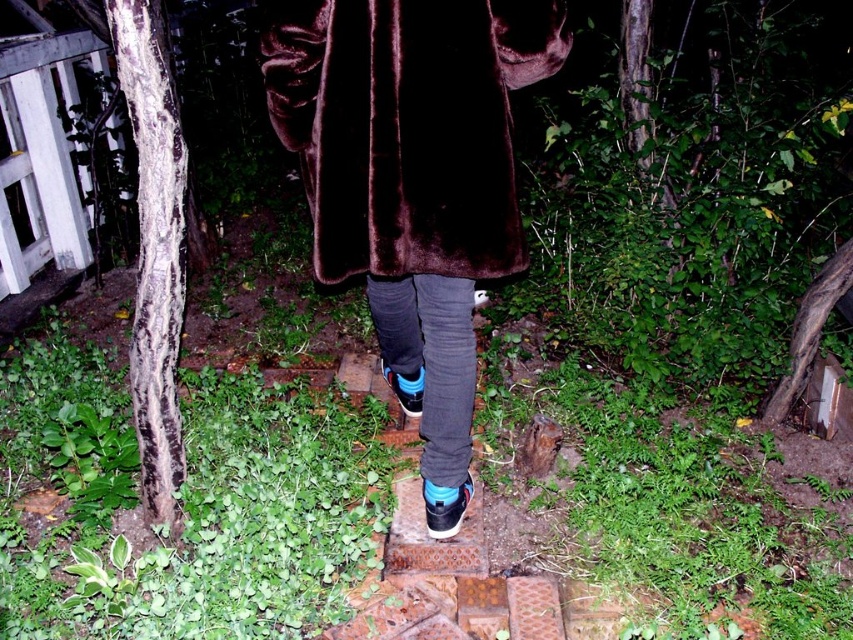
Who is more distant from viewer, (273, 36) or (149, 282)?

Point (149, 282)

Describe the element at coordinates (407, 125) in the screenshot. The width and height of the screenshot is (853, 640). I see `velvety brown coat at center` at that location.

Locate an element on the screen. velvety brown coat at center is located at coordinates (407, 125).

Does velvety brown coat at center appear on the right side of shiny black sneaker at center?

In fact, velvety brown coat at center is to the left of shiny black sneaker at center.

Which is behind, point (563, 44) or point (469, 480)?

Point (469, 480)

Is point (312, 56) in front of point (450, 525)?

Yes, it is.

Where is `velvety brown coat at center`? This screenshot has width=853, height=640. velvety brown coat at center is located at coordinates (407, 125).

Who is lower down, velvety brown coat at center or suede black shoe at center?

suede black shoe at center

Is point (517, 68) positioned after point (392, 384)?

No.

Who is more forward, (469, 202) or (421, 388)?

Point (469, 202) is in front.

Where is `velvety brown coat at center`? This screenshot has width=853, height=640. velvety brown coat at center is located at coordinates click(407, 125).